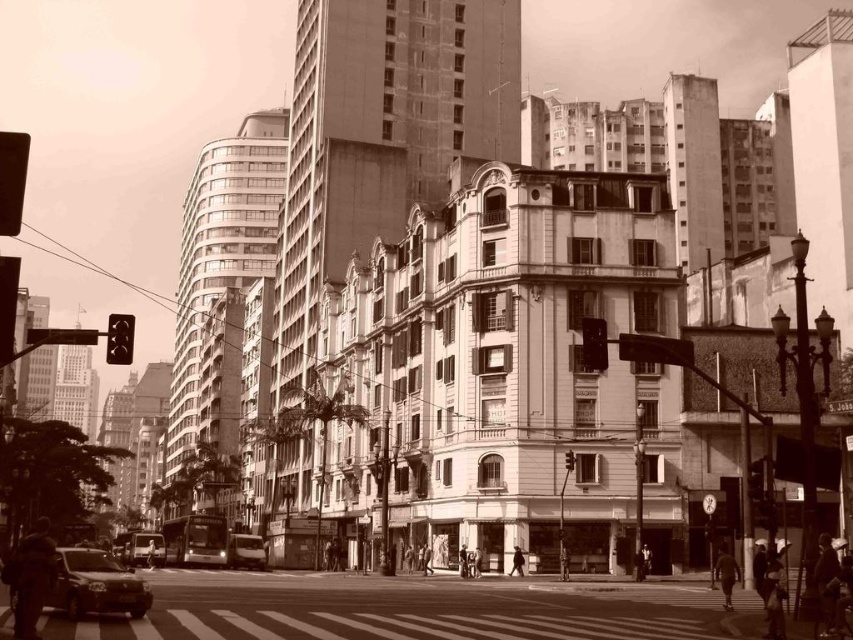
From the picture: Is shiny silver sedan at lower left shorter than black plastic traffic light at upper right?

No.

From the picture: Who is more forward, (74, 593) or (589, 360)?

Point (74, 593) is in front.

Who is more distant from viewer, [132,600] or [601,326]?

Positioned behind is point [601,326].

At what (x,y) coordinates should I click in order to perform the action: click on shiny silver sedan at lower left. Please return your answer as a coordinate pair (x, y). The height and width of the screenshot is (640, 853). Looking at the image, I should click on (94, 584).

Is black glass traffic light at upper left smaller than black plastic traffic light at upper right?

Incorrect, black glass traffic light at upper left is not smaller in size than black plastic traffic light at upper right.

Does black glass traffic light at upper left appear over black plastic traffic light at upper right?

Yes.

Is point (119, 358) positioned before point (599, 321)?

Yes, it is.

Find the location of a particular element. black glass traffic light at upper left is located at coordinates (119, 339).

From the picture: Between metallic traffic light at upper center and shiny silver bus at center, which one is positioned lower?

shiny silver bus at center is lower down.

In the scene shown: Is metallic traffic light at upper center bigger than shiny silver bus at center?

Yes, metallic traffic light at upper center is bigger than shiny silver bus at center.

Is point (674, 344) positioned after point (235, 561)?

That is False.

Image resolution: width=853 pixels, height=640 pixels. I want to click on metallic traffic light at upper center, so click(x=654, y=349).